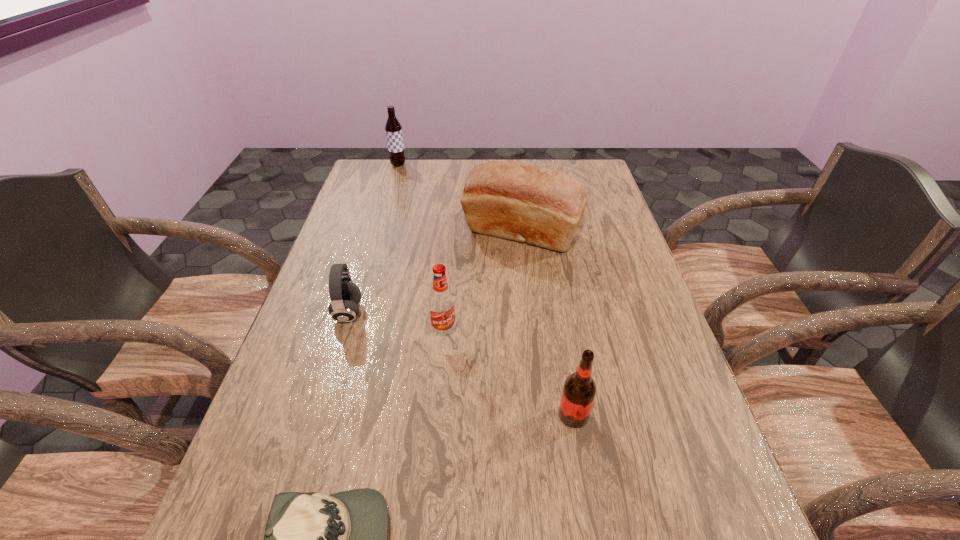
The image size is (960, 540). I want to click on the third closest root beer to the second farthest object, so click(x=579, y=390).

The width and height of the screenshot is (960, 540). I want to click on root beer that stands as the closest to the rightmost root beer, so click(442, 309).

The width and height of the screenshot is (960, 540). Find the location of `free location that satisfies the following two spatial constraints: 1. on the ear cups of the headset; 2. on the back side of the rightmost root beer`. free location that satisfies the following two spatial constraints: 1. on the ear cups of the headset; 2. on the back side of the rightmost root beer is located at coordinates (317, 415).

Image resolution: width=960 pixels, height=540 pixels. Find the location of `vacant area that satisfies the following two spatial constraints: 1. on the back side of the second nearest object; 2. on the ear cups of the headset`. vacant area that satisfies the following two spatial constraints: 1. on the back side of the second nearest object; 2. on the ear cups of the headset is located at coordinates (556, 313).

Find the location of a particular element. The width and height of the screenshot is (960, 540). free point that satisfies the following two spatial constraints: 1. on the ear cups of the rightmost root beer; 2. on the right side of the headset is located at coordinates (317, 415).

Find the location of a particular element. vacant space that satisfies the following two spatial constraints: 1. on the front side of the second root beer from left to right; 2. on the right side of the farthest object is located at coordinates (350, 333).

At what (x,y) coordinates should I click in order to perform the action: click on free location that satisfies the following two spatial constraints: 1. on the back side of the second nearest object; 2. on the ear cups of the fifth tallest object. Please return your answer as a coordinate pair (x, y). The image size is (960, 540). Looking at the image, I should click on (556, 313).